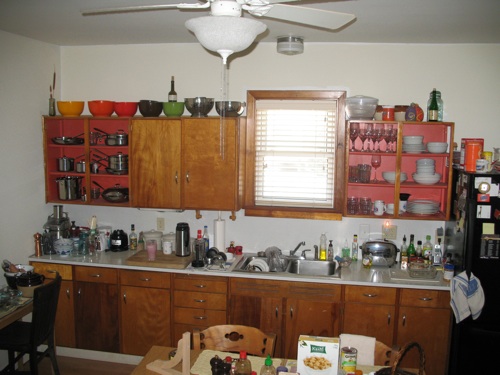
You are a GUI agent. You are given a task and a screenshot of the screen. Output one action in this format:
    pyautogui.click(x=<x>, y=<y>)
    Task: Click on the window
    The image size is (500, 375).
    Given the screenshot: What is the action you would take?
    pyautogui.click(x=273, y=146), pyautogui.click(x=304, y=180), pyautogui.click(x=309, y=136)